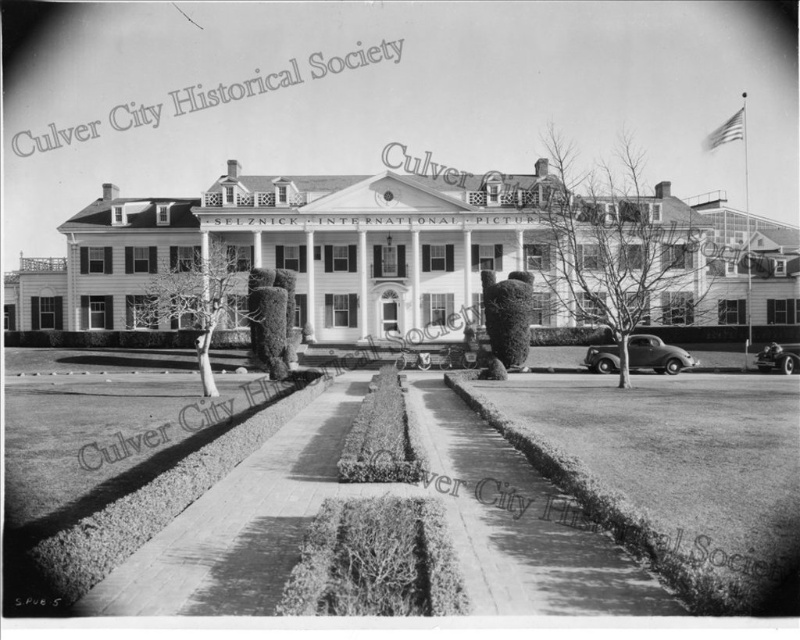
You are a visitor arriving at Selznick International Pictures. You see the shiny silver sedan at center and the shiny chrome car at lower right parked in the garden. Which car has more space around it?

The shiny silver sedan at center is bigger than the shiny chrome car at lower right, so it likely requires more space around it.

Looking at this image, you are a visitor to Selznick International Pictures and you want to park your car. You see a shiny silver sedan at center and a shiny chrome car at lower right. Which parking spot is closer to the entrance? Please explain your reasoning based on the scene description.

The shiny silver sedan at center is closer to the entrance because it is positioned at the center of the garden, which is designed with hedges leading towards the entrance. The shiny chrome car at lower right is farther away from the entrance since it is located at the lower right corner of the scene. The distance between them is 52.54 feet, indicating they are not near each other.